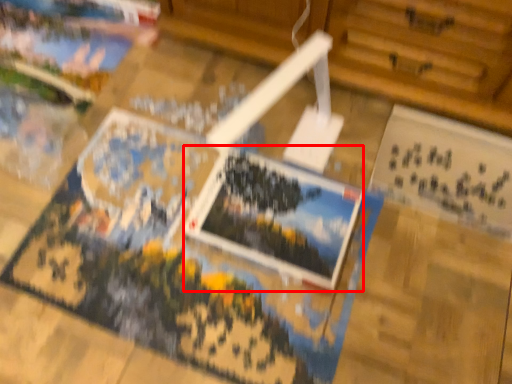
Question: From the image's perspective, what is the correct spatial relationship of postcard (annotated by the red box) in relation to postcard?

Choices:
 (A) above
 (B) below

Answer: (B)